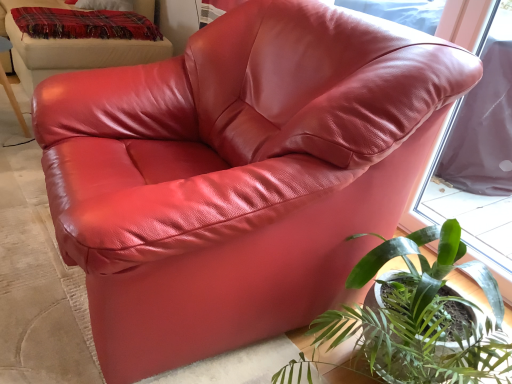
Question: From a real-world perspective, is plaid woolen blanket at upper left physically located above or below green leafy plant at lower right?

Choices:
 (A) below
 (B) above

Answer: (B)

Question: Considering the positions of point (131, 23) and point (298, 380), is point (131, 23) closer or farther from the camera than point (298, 380)?

Choices:
 (A) farther
 (B) closer

Answer: (A)

Question: Based on their relative distances, which object is farther from the green leafy plant at lower right?

Choices:
 (A) plaid woolen blanket at upper left
 (B) satin red bean bag at upper right

Answer: (A)

Question: Which object is positioned farthest from the plaid woolen blanket at upper left?

Choices:
 (A) satin red bean bag at upper right
 (B) green leafy plant at lower right

Answer: (B)